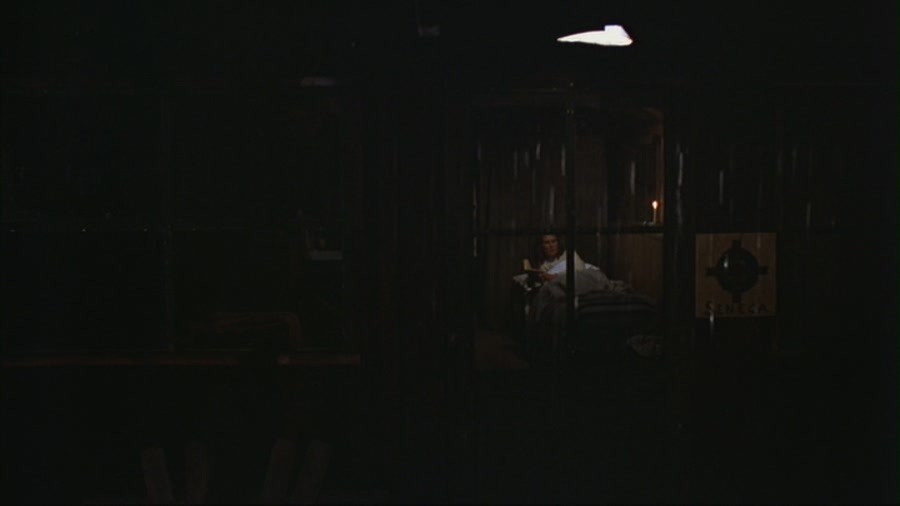
Identify the location of bedroom. (534, 197).